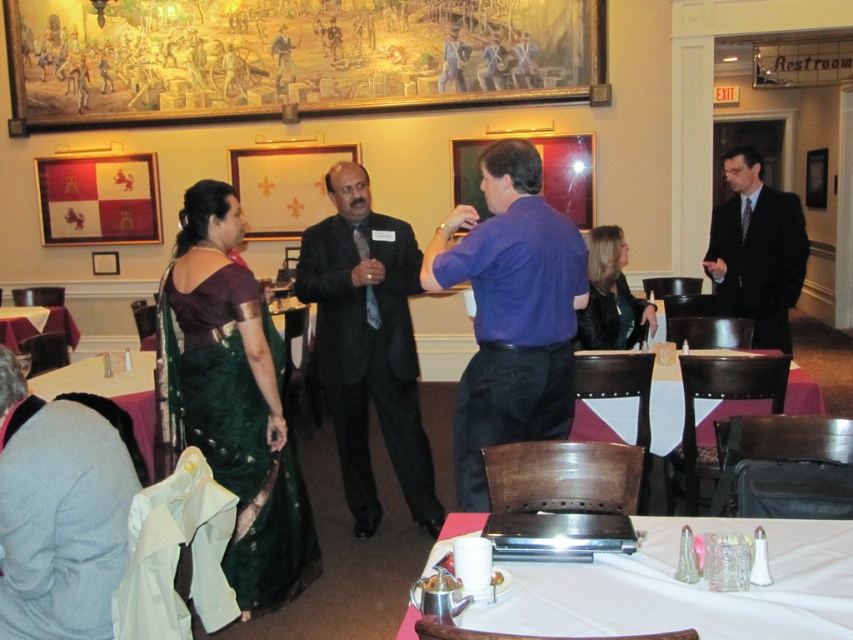
Question: Does purple cotton shirt at center appear on the left side of metallic silver laptop at center?

Choices:
 (A) yes
 (B) no

Answer: (A)

Question: Among these objects, which one is nearest to the camera?

Choices:
 (A) purple cotton shirt at center
 (B) black suit at center
 (C) white fabric table at lower left

Answer: (A)

Question: Is metallic silver laptop at center bigger than white leather table at center?

Choices:
 (A) no
 (B) yes

Answer: (A)

Question: Which point is farther to the camera?

Choices:
 (A) white fabric table at lower left
 (B) black suit at right
 (C) white leather table at center
 (D) black suit at center

Answer: (B)

Question: Estimate the real-world distances between objects in this image. Which object is closer to the metallic silver laptop at center?

Choices:
 (A) white glossy table at lower left
 (B) purple cotton shirt at center
 (C) black suit at center
 (D) black suit at right

Answer: (B)

Question: Where is white fabric table at lower left located in relation to white glossy table at lower left in the image?

Choices:
 (A) below
 (B) above

Answer: (A)